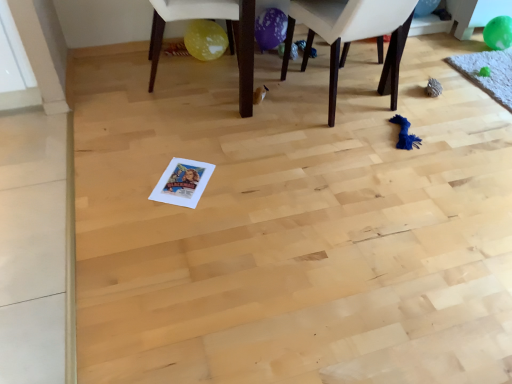
Question: Considering the relative sizes of dark brown wooden chair at center, positioned as the 2th chair in left-to-right order, and green rubber balloon at upper right, marked as the first balloon in a left-to-right arrangement, in the image provided, is dark brown wooden chair at center, positioned as the 2th chair in left-to-right order, thinner than green rubber balloon at upper right, marked as the first balloon in a left-to-right arrangement,?

Choices:
 (A) yes
 (B) no

Answer: (B)

Question: Is dark brown wooden chair at center, placed as the 1th chair when sorted from right to left, at the right side of green rubber balloon at upper right, marked as the first balloon in a left-to-right arrangement?

Choices:
 (A) yes
 (B) no

Answer: (B)

Question: From the image's perspective, is dark brown wooden chair at center, positioned as the 2th chair in left-to-right order, under green rubber balloon at upper right, which appears as the first balloon when viewed from the top?

Choices:
 (A) yes
 (B) no

Answer: (A)

Question: Would you say green rubber balloon at upper right, marked as the first balloon in a left-to-right arrangement, is part of dark brown wooden chair at center, placed as the 1th chair when sorted from right to left,'s contents?

Choices:
 (A) no
 (B) yes

Answer: (A)

Question: Considering the relative sizes of dark brown wooden chair at center, positioned as the 2th chair in left-to-right order, and green rubber balloon at upper right, placed as the second balloon when sorted from right to left, in the image provided, is dark brown wooden chair at center, positioned as the 2th chair in left-to-right order, wider than green rubber balloon at upper right, placed as the second balloon when sorted from right to left,?

Choices:
 (A) no
 (B) yes

Answer: (B)

Question: Considering the relative sizes of dark brown wooden chair at center, positioned as the 2th chair in left-to-right order, and green rubber balloon at upper right, which appears as the first balloon when viewed from the top, in the image provided, is dark brown wooden chair at center, positioned as the 2th chair in left-to-right order, taller than green rubber balloon at upper right, which appears as the first balloon when viewed from the top,?

Choices:
 (A) yes
 (B) no

Answer: (A)

Question: Can you confirm if dark brown wooden chair at center, positioned as the 2th chair in left-to-right order, is shorter than green rubber balloon at upper right, arranged as the 2th balloon when viewed from the left?

Choices:
 (A) yes
 (B) no

Answer: (B)

Question: Is dark brown wooden chair at center, placed as the 1th chair when sorted from right to left, oriented towards green rubber balloon at upper right, the second balloon when ordered from top to bottom?

Choices:
 (A) no
 (B) yes

Answer: (A)

Question: Is dark brown wooden chair at center, positioned as the 2th chair in left-to-right order, to the left of green rubber balloon at upper right, which is counted as the 1th balloon, starting from the bottom, from the viewer's perspective?

Choices:
 (A) no
 (B) yes

Answer: (B)

Question: Considering the relative positions of dark brown wooden chair at center, placed as the 1th chair when sorted from right to left, and green rubber balloon at upper right, arranged as the 2th balloon when viewed from the left, in the image provided, is dark brown wooden chair at center, placed as the 1th chair when sorted from right to left, to the right of green rubber balloon at upper right, arranged as the 2th balloon when viewed from the left, from the viewer's perspective?

Choices:
 (A) no
 (B) yes

Answer: (A)

Question: Considering the relative positions of dark brown wooden chair at center, placed as the 1th chair when sorted from right to left, and green rubber balloon at upper right, the second balloon when ordered from top to bottom, in the image provided, is dark brown wooden chair at center, placed as the 1th chair when sorted from right to left, in front of green rubber balloon at upper right, the second balloon when ordered from top to bottom,?

Choices:
 (A) yes
 (B) no

Answer: (A)

Question: Considering the relative sizes of dark brown wooden chair at center, placed as the 1th chair when sorted from right to left, and green rubber balloon at upper right, arranged as the 2th balloon when viewed from the left, in the image provided, is dark brown wooden chair at center, placed as the 1th chair when sorted from right to left, wider than green rubber balloon at upper right, arranged as the 2th balloon when viewed from the left,?

Choices:
 (A) no
 (B) yes

Answer: (B)

Question: Does green rubber balloon at upper right, the 2th balloon when ordered from bottom to top, lie behind green rubber balloon at upper right, which is counted as the 1th balloon, starting from the bottom?

Choices:
 (A) yes
 (B) no

Answer: (A)